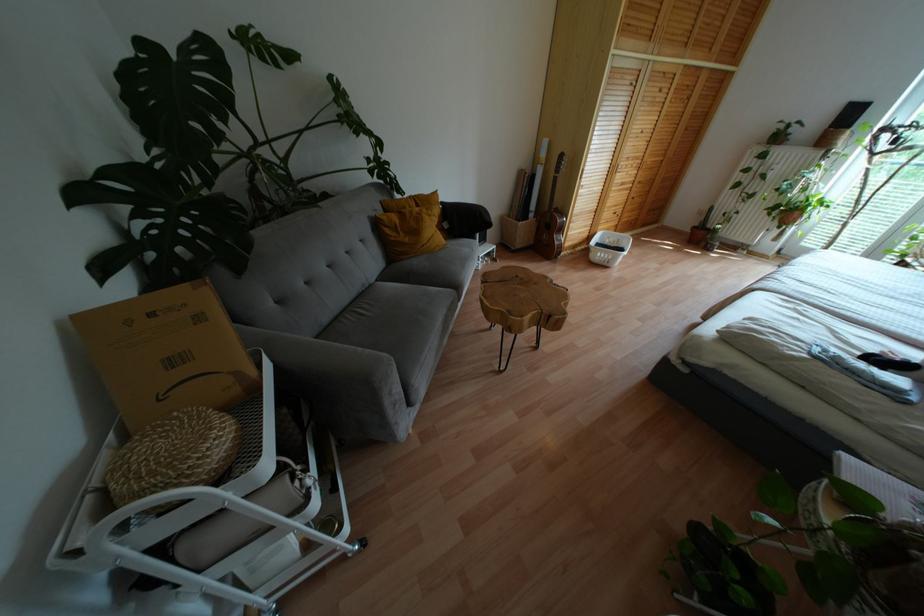
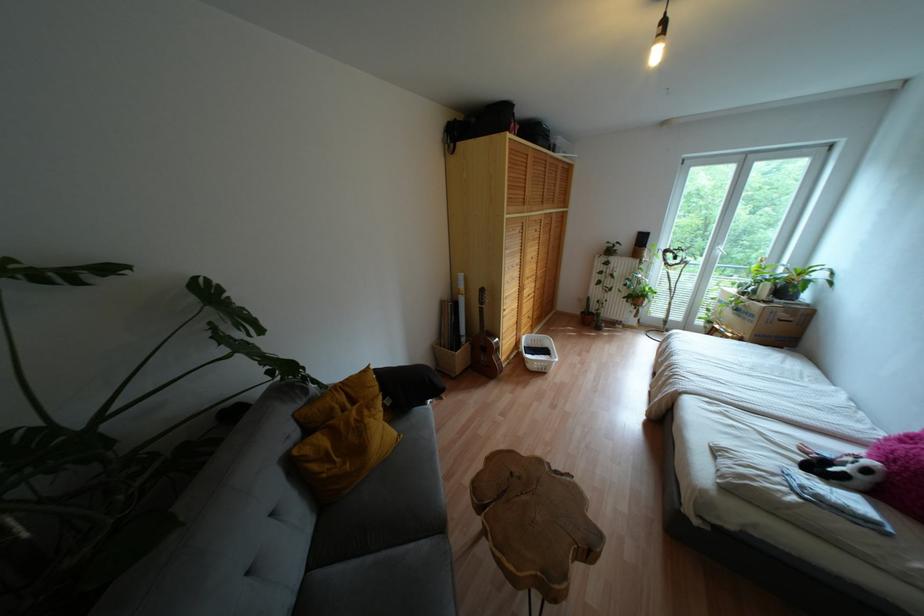
The point at [561,156] is marked in the first image. Where is the corresponding point in the second image?

(481, 290)